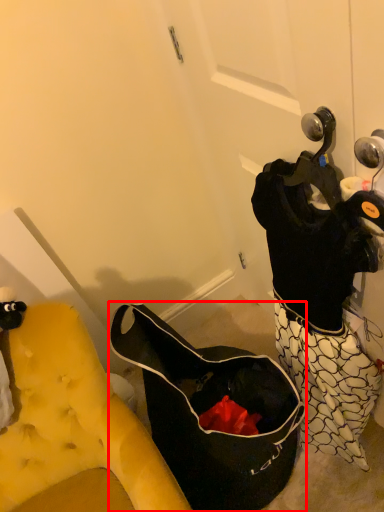
Question: Where is handbag (annotated by the red box) located in relation to furniture in the image?

Choices:
 (A) right
 (B) left

Answer: (A)